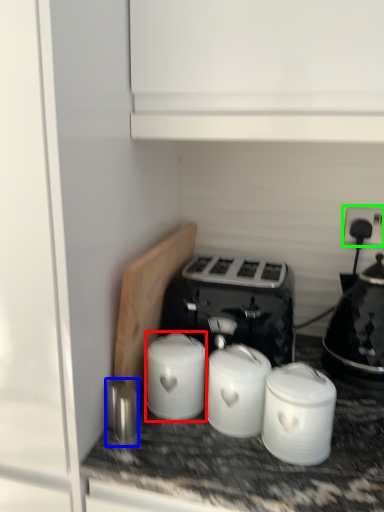
Question: Considering the real-world distances, which object is farthest from appliance (highlighted by a red box)? appliance (highlighted by a blue box) or electric outlet (highlighted by a green box)?

Choices:
 (A) appliance
 (B) electric outlet

Answer: (B)